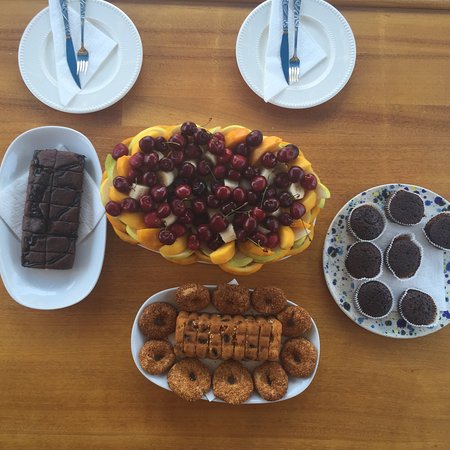
Where is `napkins`? This screenshot has width=450, height=450. napkins is located at coordinates (64, 92), (276, 90).